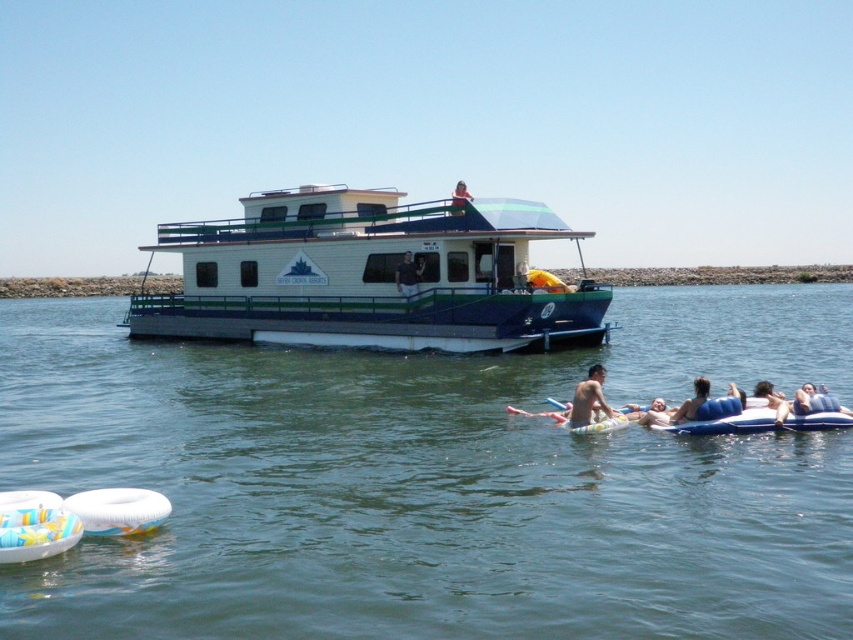
You are a lifeguard on duty at the water park and need to reach a swimmer in distress. The swimmer is wearing a white fabric shirt at center. There is also a person with smooth tan skin at upper center. Your rescue equipment is 5 meters away from your current position. Can you reach the swimmer before your equipment runs out of range?

The distance between the white fabric shirt at center and the smooth tan skin at upper center is 4.82 meters. Since your rescue equipment has a 5 meter range, you can reach the swimmer in time.

You are a guest staying at the Seven Crown Resorts houseboat. You want to take a photo of the skinny man at center while standing on the green smooth water at center. Is this possible?

The green smooth water at center is bigger than skinny man at center, so yes, you can take a photo of the skinny man at center while standing on the green smooth water at center since there is enough space.

You are a guest staying on the white glossy houseboat at center and want to wave to someone wearing the white fabric shirt at center. Can you see their face clearly from your position on the balcony?

The white glossy houseboat at center is much taller than the white fabric shirt at center, so yes, you can see their face clearly from the balcony.